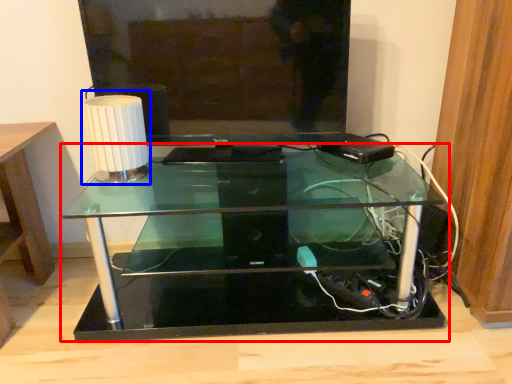
Question: Which point is closer to the camera, table (highlighted by a red box) or table lamp (highlighted by a blue box)?

Choices:
 (A) table
 (B) table lamp

Answer: (A)